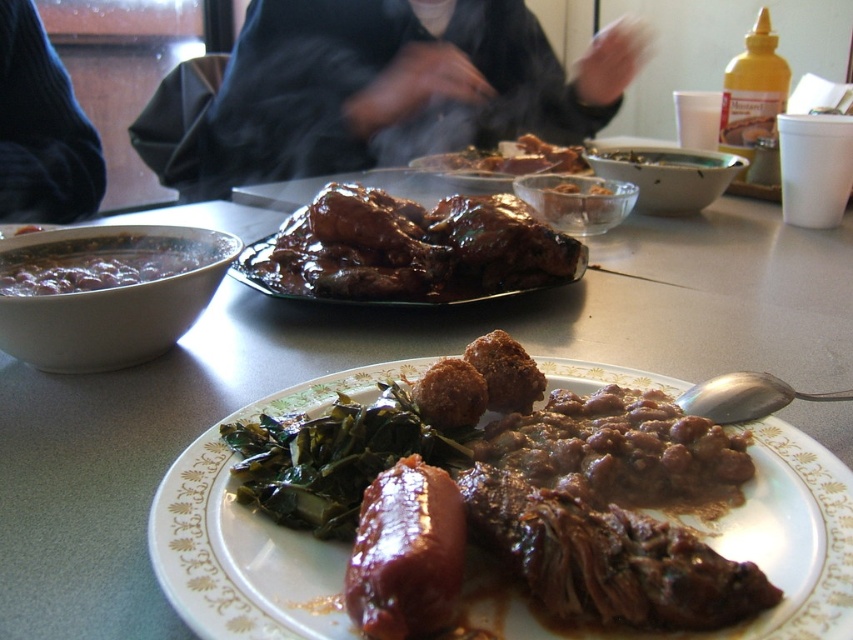
Image resolution: width=853 pixels, height=640 pixels. What do you see at coordinates (743, 548) in the screenshot? I see `brown matte plate at center` at bounding box center [743, 548].

Can you confirm if brown matte plate at center is positioned to the left of brown matte beans at left?

→ In fact, brown matte plate at center is to the right of brown matte beans at left.

Identify the location of brown matte plate at center. (743, 548).

Can you confirm if black matte jacket at upper center is taller than glossy brown meat at center?

Yes.

This screenshot has width=853, height=640. In order to click on black matte jacket at upper center in this screenshot , I will do `click(396, 84)`.

Is brown matte plate at center to the left of glossy brown sausage at center from the viewer's perspective?

No, brown matte plate at center is not to the left of glossy brown sausage at center.

Can you confirm if brown matte plate at center is bigger than glossy brown sausage at center?

Yes, brown matte plate at center is bigger than glossy brown sausage at center.

Which is in front, point (233, 525) or point (465, 529)?

Point (465, 529) is more forward.

Locate an element on the screen. This screenshot has width=853, height=640. brown matte plate at center is located at coordinates (743, 548).